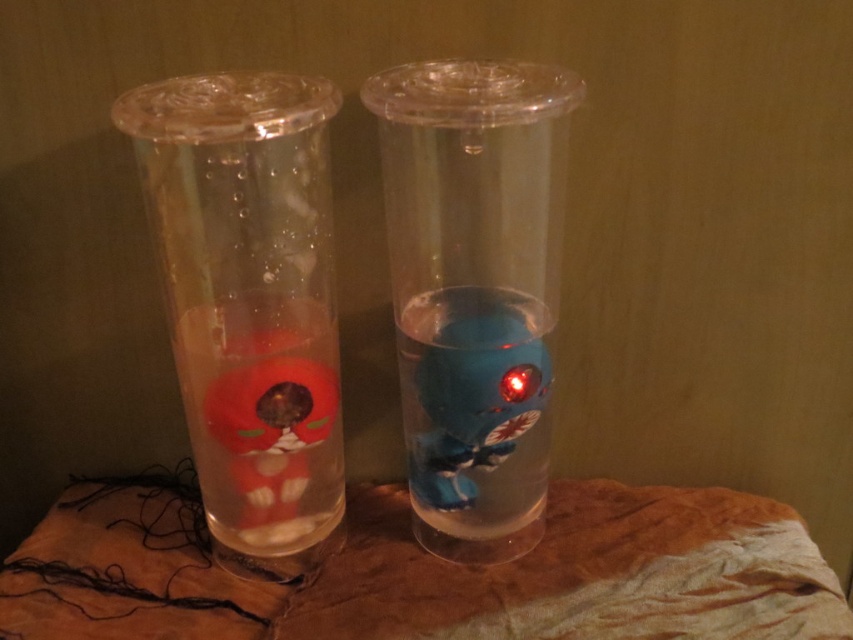
Does brown fabric at center appear over transparent plastic vase at center?

Actually, brown fabric at center is below transparent plastic vase at center.

Image resolution: width=853 pixels, height=640 pixels. What do you see at coordinates (430, 572) in the screenshot?
I see `brown fabric at center` at bounding box center [430, 572].

The image size is (853, 640). I want to click on brown fabric at center, so click(430, 572).

Where is `brown fabric at center`? The height and width of the screenshot is (640, 853). brown fabric at center is located at coordinates (430, 572).

Can you confirm if brown fabric at center is smaller than matte plastic cup at left?

Correct, brown fabric at center occupies less space than matte plastic cup at left.

Between brown fabric at center and matte plastic cup at left, which one appears on the left side from the viewer's perspective?

Positioned to the left is matte plastic cup at left.

Find the location of a particular element. This screenshot has width=853, height=640. brown fabric at center is located at coordinates (430, 572).

Based on the photo, does matte plastic cup at left have a lesser height compared to transparent plastic vase at center?

Yes, matte plastic cup at left is shorter than transparent plastic vase at center.

Between point (279, 554) and point (502, 243), which one is positioned in front?

Positioned in front is point (502, 243).

Image resolution: width=853 pixels, height=640 pixels. What are the coordinates of `matte plastic cup at left` in the screenshot? It's located at (248, 304).